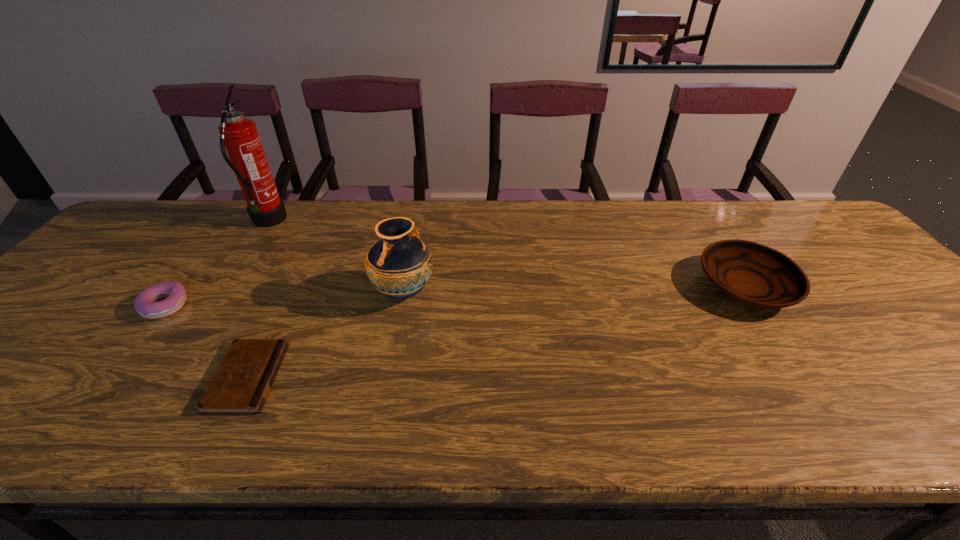
The width and height of the screenshot is (960, 540). I want to click on vacant region located 0.220m on the front-facing side of the fourth object from right to left, so click(356, 222).

Find the location of `vacant position located 0.070m on the back of the second object from right to left`. vacant position located 0.070m on the back of the second object from right to left is located at coordinates (411, 255).

At what (x,y) coordinates should I click in order to perform the action: click on vacant point located on the right of the third shortest object. Please return your answer as a coordinate pair (x, y). This screenshot has height=540, width=960. Looking at the image, I should click on (871, 286).

Identify the location of free space located 0.070m on the left of the pastry. (114, 305).

Identify the location of blank space located on the spine side of the diary. (357, 377).

You are a GUI agent. You are given a task and a screenshot of the screen. Output one action in this format:
    pyautogui.click(x=<x>, y=<y>)
    Task: Click on the object positioned at the far edge
    
    Given the screenshot: What is the action you would take?
    pyautogui.click(x=239, y=135)

The image size is (960, 540). I want to click on object present at the near edge, so (241, 384).

Where is `vacant space at the far edge`? The image size is (960, 540). vacant space at the far edge is located at coordinates (678, 234).

I want to click on vacant space at the left edge, so click(21, 369).

In the image, there is a desktop. Where is `vacant space at the right edge`? The image size is (960, 540). vacant space at the right edge is located at coordinates (893, 324).